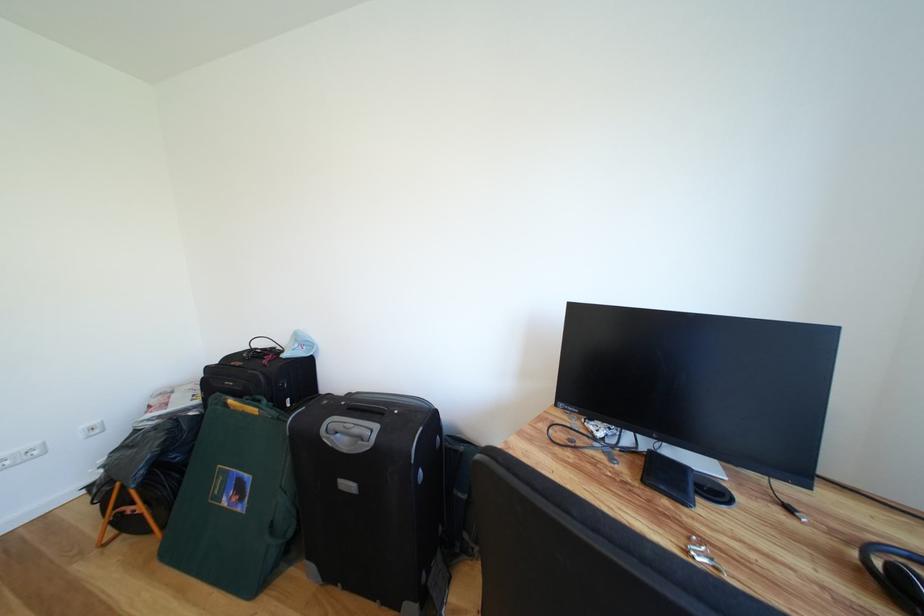
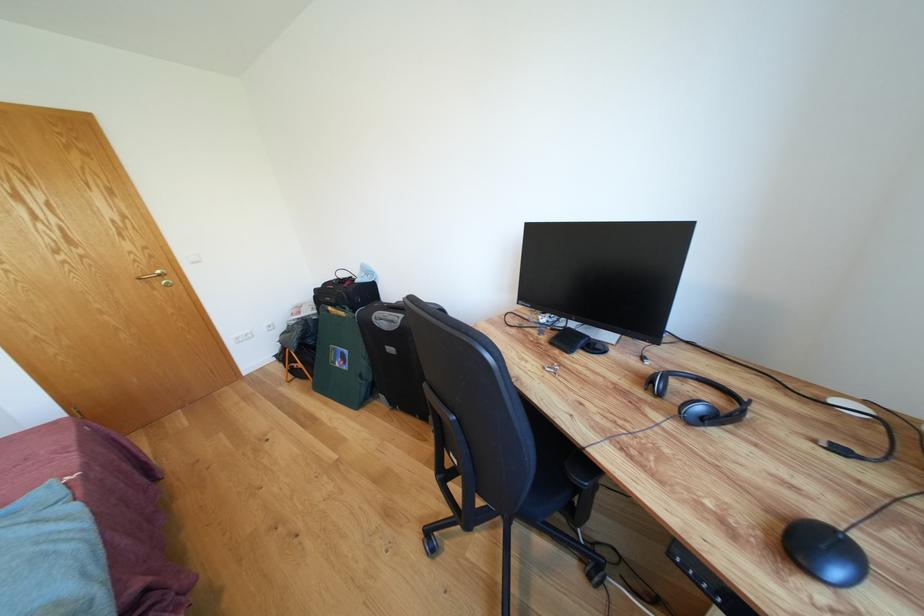
Where in the second image is the point corresponding to (630,474) from the first image?

(553, 342)